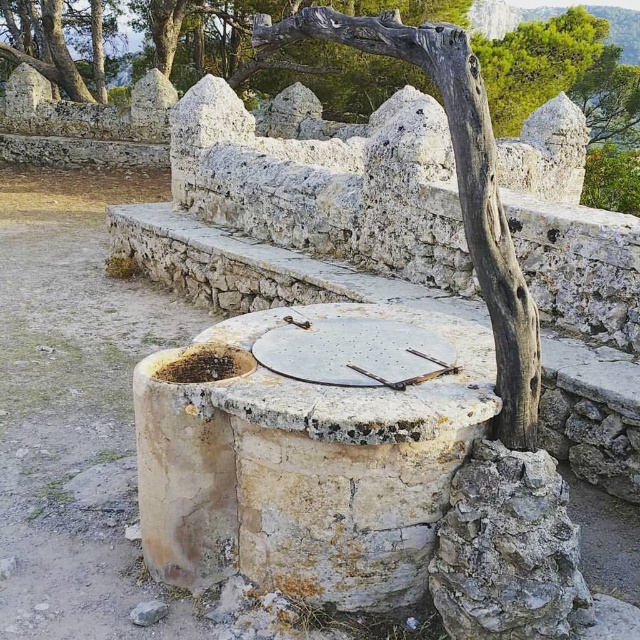
Between smooth gray stone wall at upper center and gray rough tree trunk at center, which one is positioned lower?

gray rough tree trunk at center is below.

Is point (284, 8) farther from viewer compared to point (467, 140)?

That is True.

Who is more distant from viewer, (186, 72) or (492, 301)?

Positioned behind is point (186, 72).

Locate an element on the screen. The width and height of the screenshot is (640, 640). smooth gray stone wall at upper center is located at coordinates (284, 51).